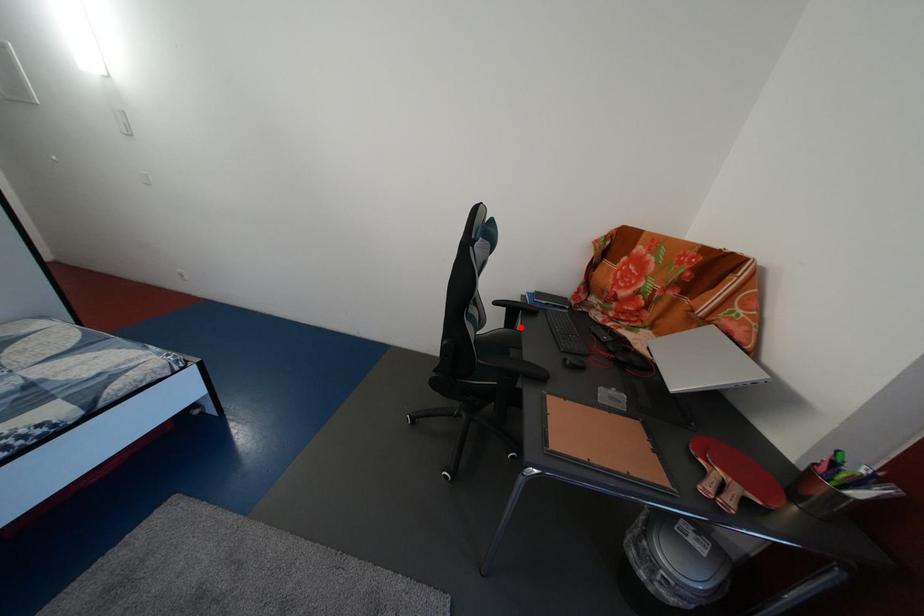
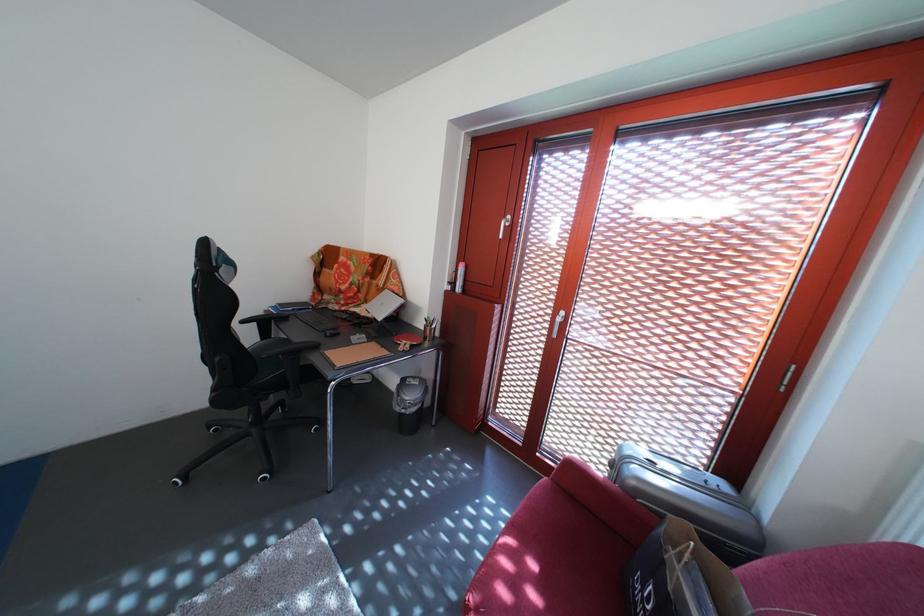
The point at the highlighted location is marked in the first image. Where is the corresponding point in the second image?

(275, 339)